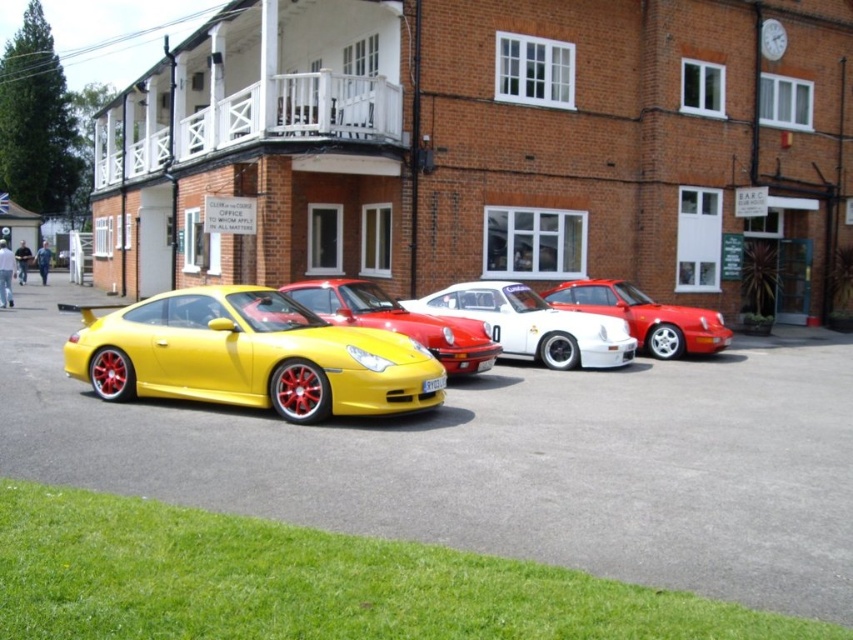
Question: Can you confirm if yellow matte sports car at center is bigger than shiny red porsche at center?

Choices:
 (A) yes
 (B) no

Answer: (B)

Question: Can you confirm if yellow matte sports car at center is positioned below shiny red porsche at center?

Choices:
 (A) yes
 (B) no

Answer: (A)

Question: Considering the relative positions of matte yellow sports car at left and yellow matte sports car at center in the image provided, where is matte yellow sports car at left located with respect to yellow matte sports car at center?

Choices:
 (A) below
 (B) above

Answer: (B)

Question: Which point is closer to the camera taking this photo?

Choices:
 (A) (302, 417)
 (B) (552, 360)
 (C) (347, 291)

Answer: (A)

Question: Which object is farther from the camera taking this photo?

Choices:
 (A) shiny red porsche at center
 (B) matte yellow sports car at left

Answer: (A)

Question: Which object is positioned closest to the shiny red porsche at center?

Choices:
 (A) yellow matte sports car at center
 (B) matte yellow sports car at left

Answer: (A)